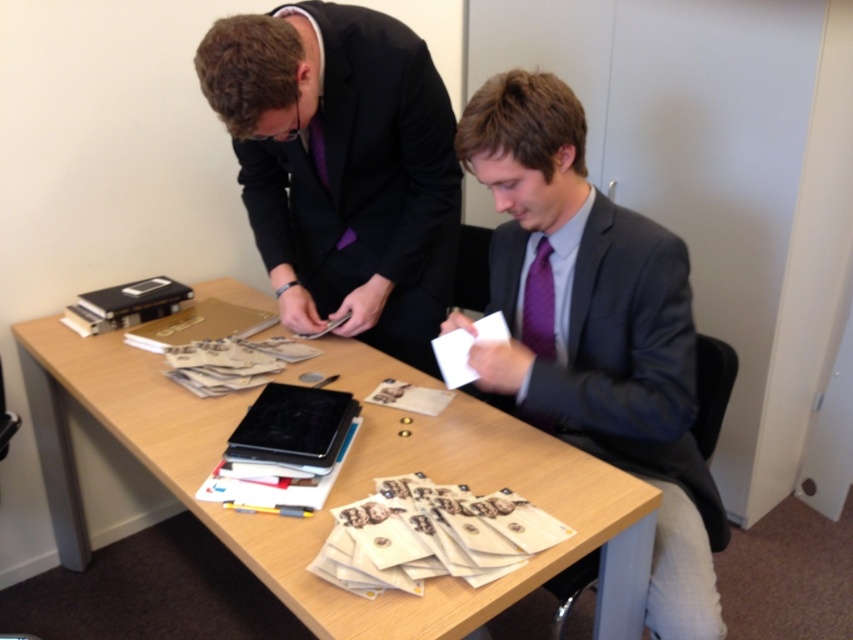
Question: Can you confirm if light brown wood table at center is positioned to the left of matte gray suit at center?

Choices:
 (A) yes
 (B) no

Answer: (A)

Question: Is matte gray suit at center to the left of purple satin tie at center from the viewer's perspective?

Choices:
 (A) yes
 (B) no

Answer: (B)

Question: Which of the following is the farthest from the observer?

Choices:
 (A) matte black suit at center
 (B) matte gray suit at center
 (C) purple satin tie at center
 (D) light brown wood table at center

Answer: (C)

Question: Observing the image, what is the correct spatial positioning of light brown wood table at center in reference to white paper at lower center?

Choices:
 (A) below
 (B) above

Answer: (A)

Question: Which of these objects is positioned closest to the light brown wood table at center?

Choices:
 (A) matte gray suit at center
 (B) purple satin tie at center
 (C) white paper at lower center

Answer: (A)

Question: Which of the following is the closest to the observer?

Choices:
 (A) (531, 280)
 (B) (505, 324)

Answer: (A)